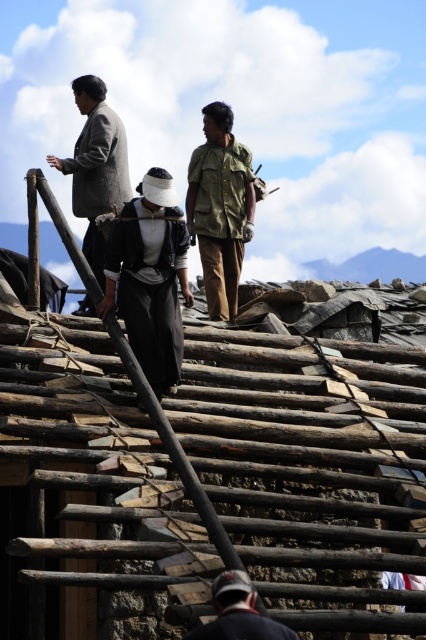
Question: Which object is positioned closest to the dark gray fabric construction worker at center?

Choices:
 (A) dark blue fabric cap at lower center
 (B) gray woolen coat at upper left
 (C) matte khaki shirt at center

Answer: (B)

Question: Can you confirm if dark gray fabric construction worker at center is positioned above dark blue fabric cap at lower center?

Choices:
 (A) yes
 (B) no

Answer: (A)

Question: From the image, what is the correct spatial relationship of matte khaki shirt at center in relation to dark blue fabric cap at lower center?

Choices:
 (A) left
 (B) right

Answer: (A)

Question: Which point is closer to the camera?

Choices:
 (A) dark gray fabric construction worker at center
 (B) gray woolen coat at upper left
 (C) matte khaki shirt at center
 (D) dark blue fabric cap at lower center

Answer: (D)

Question: Is matte khaki shirt at center to the left of gray woolen coat at upper left from the viewer's perspective?

Choices:
 (A) no
 (B) yes

Answer: (A)

Question: Among these objects, which one is farthest from the camera?

Choices:
 (A) dark gray fabric construction worker at center
 (B) gray woolen coat at upper left
 (C) matte khaki shirt at center
 (D) dark blue fabric cap at lower center

Answer: (C)